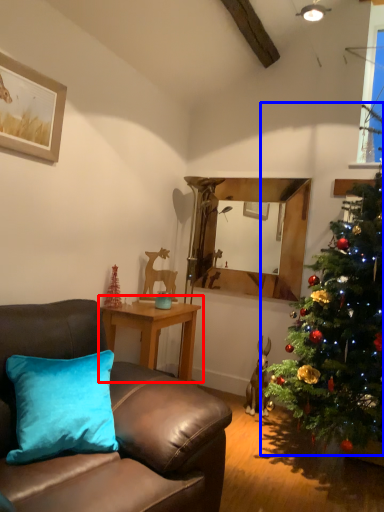
Question: Which of the following is the farthest to the observer, table (highlighted by a red box) or christmas tree (highlighted by a blue box)?

Choices:
 (A) table
 (B) christmas tree

Answer: (A)